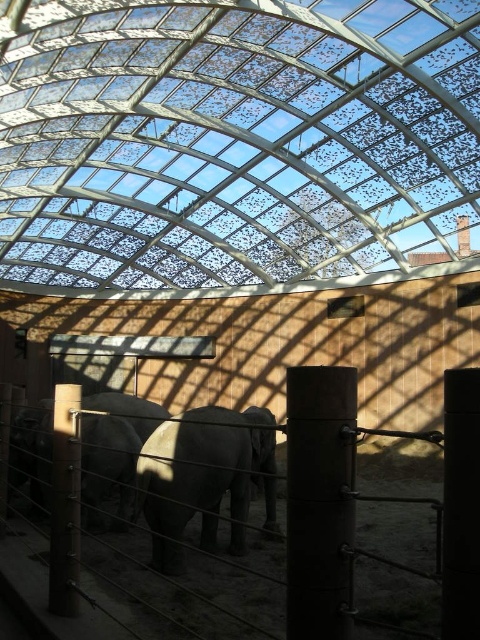
Question: Based on their relative distances, which object is nearer to the gray matte elephant at left?

Choices:
 (A) gray matte elephant at center
 (B) brown metal fence at lower left

Answer: (A)

Question: Among these objects, which one is farthest from the camera?

Choices:
 (A) gray matte elephant at center
 (B) gray matte elephant at left
 (C) brown metal fence at lower left

Answer: (B)

Question: From the image, what is the correct spatial relationship of brown metal fence at lower left in relation to gray matte elephant at left?

Choices:
 (A) below
 (B) above

Answer: (A)

Question: Based on their relative distances, which object is farther from the brown metal fence at lower left?

Choices:
 (A) gray matte elephant at left
 (B) gray matte elephant at center

Answer: (A)

Question: Observing the image, what is the correct spatial positioning of gray matte elephant at center in reference to gray matte elephant at left?

Choices:
 (A) above
 (B) below

Answer: (A)

Question: Can you confirm if brown metal fence at lower left is bigger than gray matte elephant at center?

Choices:
 (A) no
 (B) yes

Answer: (A)